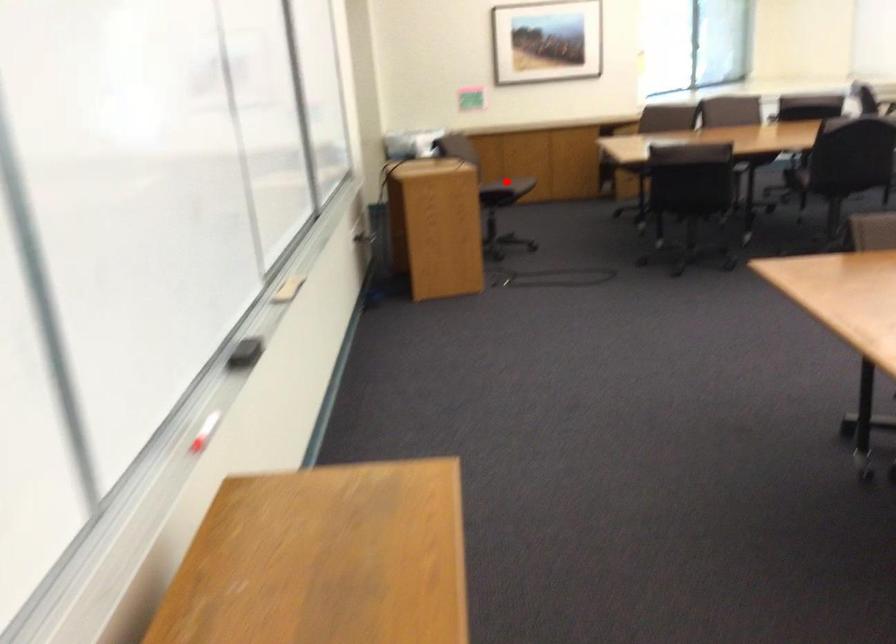
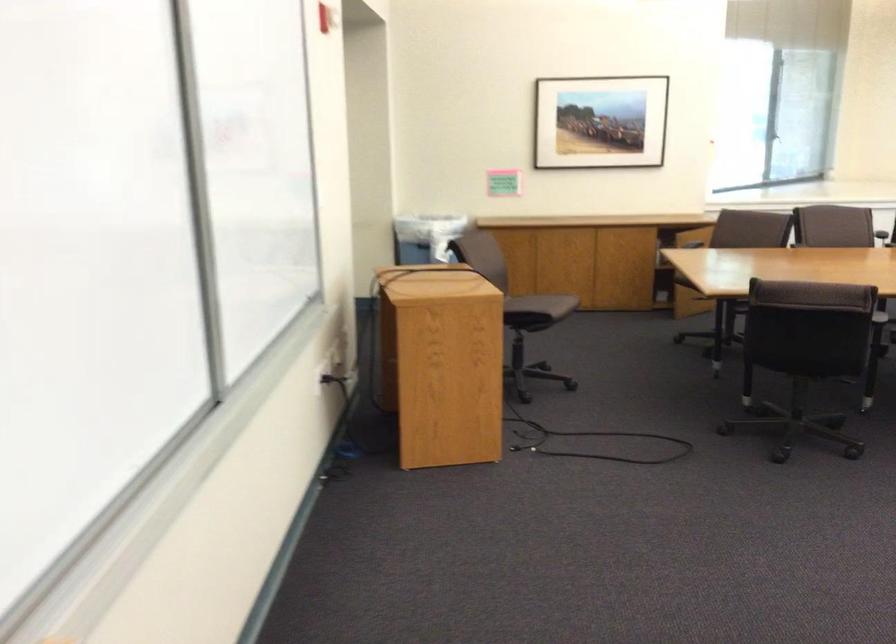
Question: I am providing you with two images of the same scene from different viewpoints. A red point is marked on the first image. Is the red point's position out of view in image 2?

Choices:
 (A) Yes
 (B) No

Answer: (A)